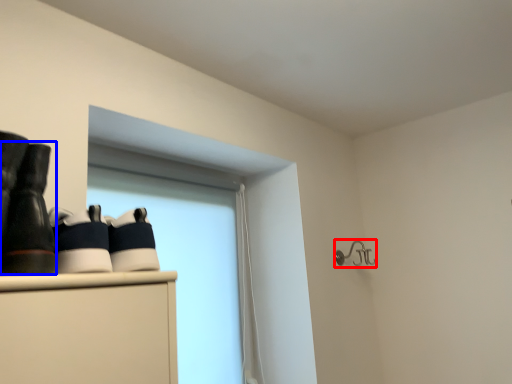
Question: Which object appears closest to the camera in this image, shower (highlighted by a red box) or footwear (highlighted by a blue box)?

Choices:
 (A) shower
 (B) footwear

Answer: (B)